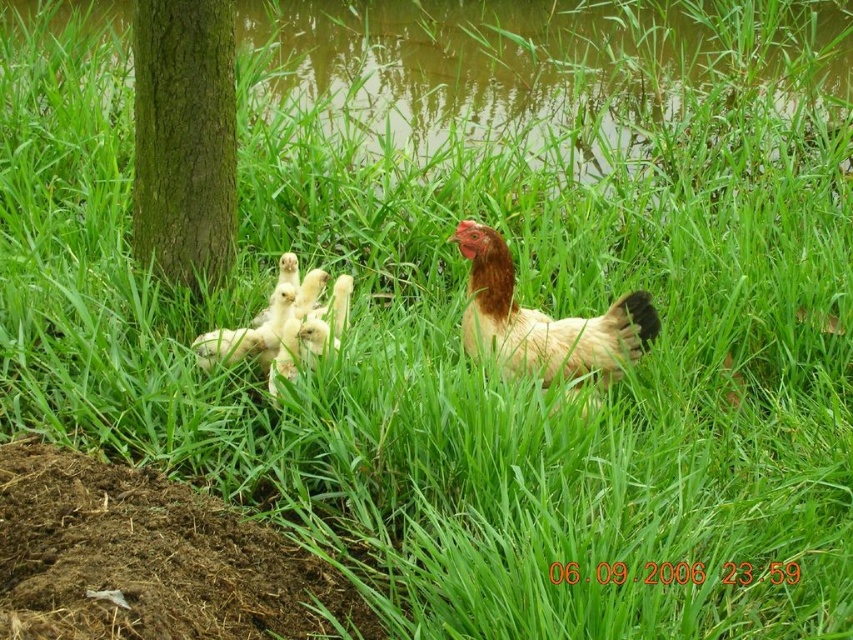
Question: Which point is farther to the camera?

Choices:
 (A) (254, 333)
 (B) (480, 237)

Answer: (A)

Question: Which of these objects is positioned closest to the brown feathered chicken at center?

Choices:
 (A) green rough bark tree at left
 (B) yellow fluffy chicks at center

Answer: (B)

Question: Which object is the closest to the yellow fluffy chicks at center?

Choices:
 (A) green rough bark tree at left
 (B) brown feathered chicken at center

Answer: (A)

Question: Does brown feathered chicken at center have a smaller size compared to yellow fluffy chicks at center?

Choices:
 (A) no
 (B) yes

Answer: (B)

Question: Is brown feathered chicken at center in front of yellow fluffy chicks at center?

Choices:
 (A) yes
 (B) no

Answer: (A)

Question: Can you confirm if green rough bark tree at left is positioned below yellow fluffy chicks at center?

Choices:
 (A) yes
 (B) no

Answer: (B)